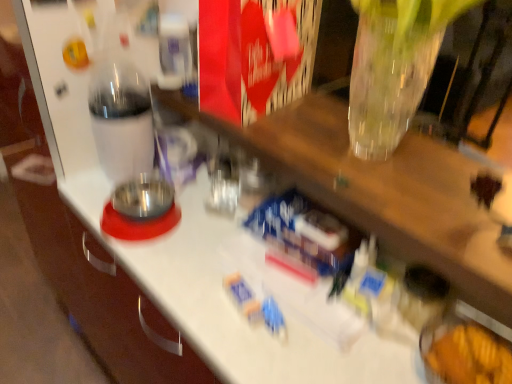
Question: Which direction should I rotate to face blue plastic toy at center, placed as the first toy when sorted from top to bottom, — up or down?

Choices:
 (A) up
 (B) down

Answer: (B)

Question: Is blue plastic toy at center, placed as the first toy when sorted from top to bottom, located within transparent plastic bottle at left?

Choices:
 (A) no
 (B) yes

Answer: (A)

Question: Is blue plastic toy at center, placed as the first toy when sorted from top to bottom, at the back of transparent plastic bottle at left?

Choices:
 (A) yes
 (B) no

Answer: (B)

Question: Is the position of transparent plastic bottle at left more distant than that of blue plastic toy at center, placed as the first toy when sorted from top to bottom?

Choices:
 (A) no
 (B) yes

Answer: (B)

Question: Is transparent plastic bottle at left outside blue plastic toy at center, arranged as the 2th toy when ordered from the bottom?

Choices:
 (A) yes
 (B) no

Answer: (A)

Question: Can you confirm if transparent plastic bottle at left is smaller than blue plastic toy at center, placed as the first toy when sorted from top to bottom?

Choices:
 (A) no
 (B) yes

Answer: (A)

Question: From the image's perspective, would you say transparent plastic bottle at left is positioned over blue plastic toy at center, arranged as the 2th toy when ordered from the bottom?

Choices:
 (A) no
 (B) yes

Answer: (B)

Question: Does blue plastic toy at center, arranged as the 2th toy when ordered from the bottom, turn towards transparent plastic bottle at left?

Choices:
 (A) yes
 (B) no

Answer: (B)

Question: Is blue plastic toy at center, placed as the first toy when sorted from top to bottom, directly adjacent to transparent plastic bottle at left?

Choices:
 (A) yes
 (B) no

Answer: (B)

Question: Is transparent plastic bottle at left inside blue plastic toy at center, placed as the first toy when sorted from top to bottom?

Choices:
 (A) yes
 (B) no

Answer: (B)

Question: Is the depth of blue plastic toy at center, arranged as the 2th toy when ordered from the bottom, greater than that of transparent plastic bottle at left?

Choices:
 (A) yes
 (B) no

Answer: (B)

Question: Is blue plastic toy at center, arranged as the 2th toy when ordered from the bottom, shorter than transparent plastic bottle at left?

Choices:
 (A) yes
 (B) no

Answer: (A)

Question: Is blue plastic toy at center, arranged as the 2th toy when ordered from the bottom, looking in the opposite direction of transparent plastic bottle at left?

Choices:
 (A) no
 (B) yes

Answer: (A)

Question: Is transparent plastic bottle at left far from blue plastic toy at center, the second toy when ordered from top to bottom?

Choices:
 (A) no
 (B) yes

Answer: (A)